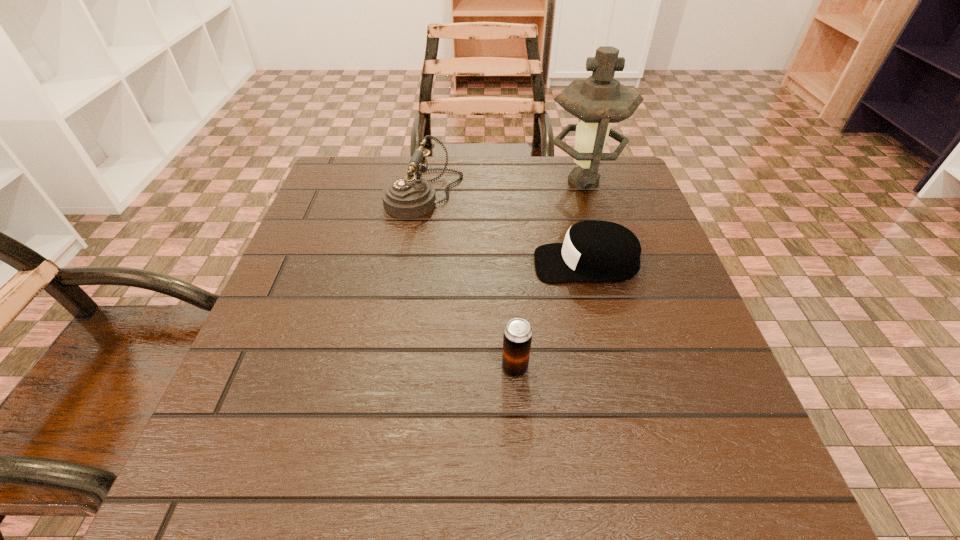
Locate an element on the screen. unoccupied area between the beer can and the second tallest object is located at coordinates (469, 281).

Image resolution: width=960 pixels, height=540 pixels. Find the location of `vacant space in between the cap and the telephone`. vacant space in between the cap and the telephone is located at coordinates (505, 229).

The width and height of the screenshot is (960, 540). Identify the location of free space between the third tallest object and the leftmost object. (469, 281).

This screenshot has width=960, height=540. In order to click on unoccupied position between the telephone and the tallest object in this screenshot , I will do `click(504, 188)`.

Image resolution: width=960 pixels, height=540 pixels. Identify the location of object that stands as the third closest to the cap. (517, 337).

Where is `object that stands as the third closest to the shortest object`? The width and height of the screenshot is (960, 540). object that stands as the third closest to the shortest object is located at coordinates (517, 337).

At what (x,y) coordinates should I click in order to perform the action: click on free location that satisfies the following two spatial constraints: 1. on the back side of the tallest object; 2. on the left side of the leftmost object. Please return your answer as a coordinate pair (x, y). The image size is (960, 540). Looking at the image, I should click on (426, 181).